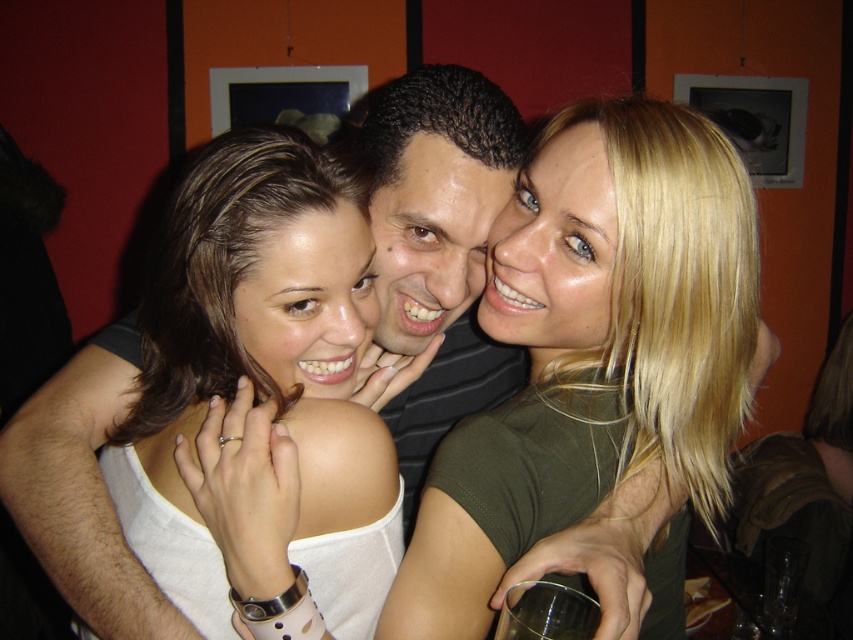
You are a photographer trying to adjust the lighting for a portrait. You notice the white matte tank top at center and the dark brown curly hair at center in your frame. Which object should you focus on if you want to highlight the one that is positioned lower in the image?

The white matte tank top at center is located below the dark brown curly hair at center, so you should focus on the white matte tank top at center to highlight the lower positioned object.

You are a photographer trying to adjust the lighting for a group photo. You notice the matte olive green shirt at center and the dark brown curly hair at center. Which object should you focus on to ensure proper exposure since it takes up more space in the frame?

The matte olive green shirt at center should be focused on for proper exposure because it has a larger size compared to the dark brown curly hair at center.

You are a photographer adjusting the focus on your camera. You want to ensure that the white matte tank top at center is in sharp focus. Based on the given information, what is the ideal distance you should set your camera focus to?

The ideal focus distance should be set to 24.32 inches, as the white matte tank top at center is positioned exactly 24.32 inches away from the camera.